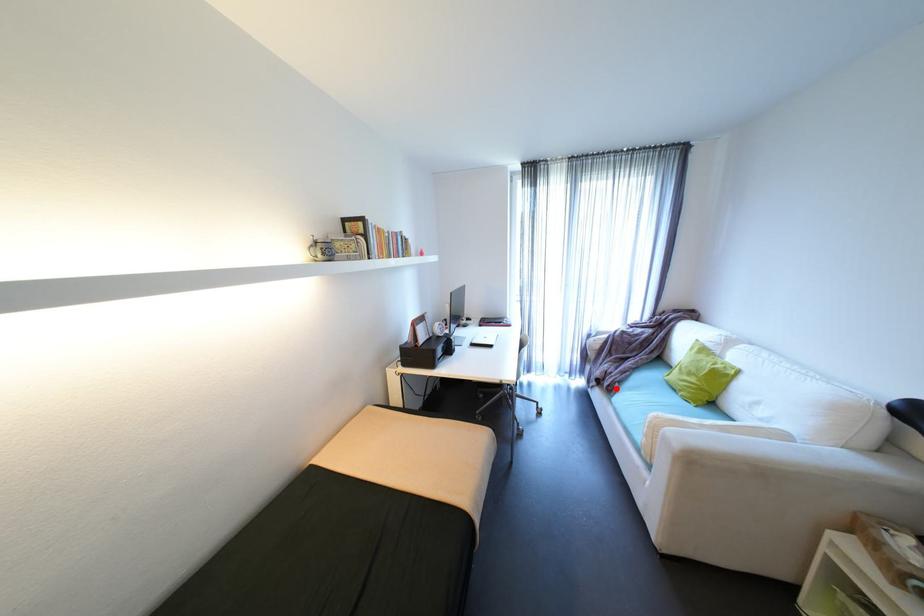
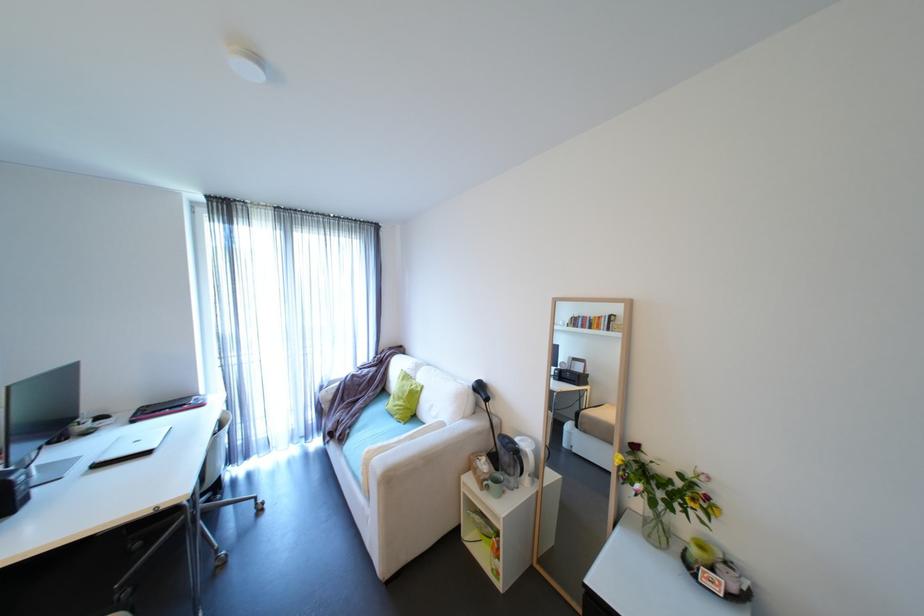
Question: I am providing you with two images of the same scene from different viewpoints. A red point is shown in image1. For the corresponding object point in image2, is it positioned nearer or farther from the camera?

Choices:
 (A) Nearer
 (B) Farther

Answer: (B)